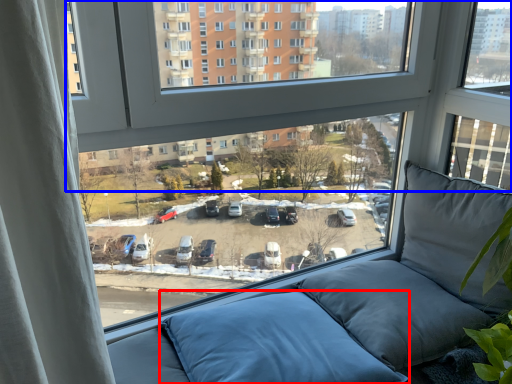
Question: Which of the following is the closest to the observer, pillow (highlighted by a red box) or window (highlighted by a blue box)?

Choices:
 (A) pillow
 (B) window

Answer: (B)